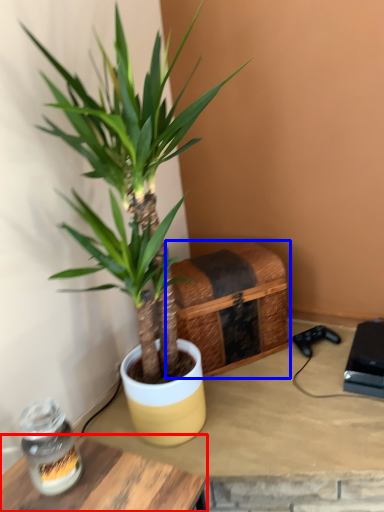
Question: Among these objects, which one is farthest to the camera, table (highlighted by a red box) or crate (highlighted by a blue box)?

Choices:
 (A) table
 (B) crate

Answer: (B)